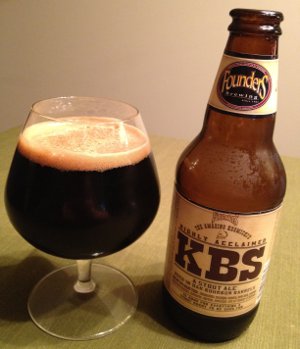
Identify the location of base of glass. (95, 315).